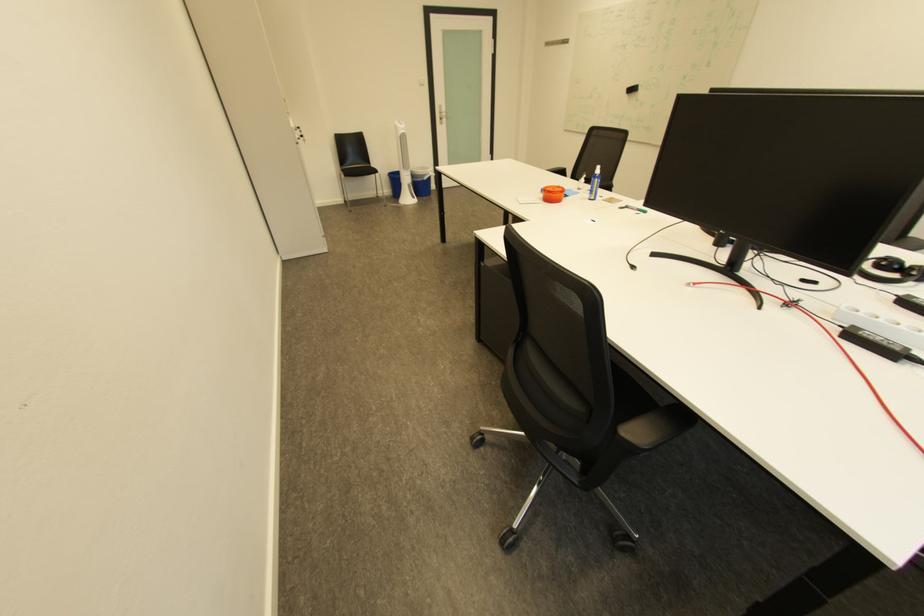
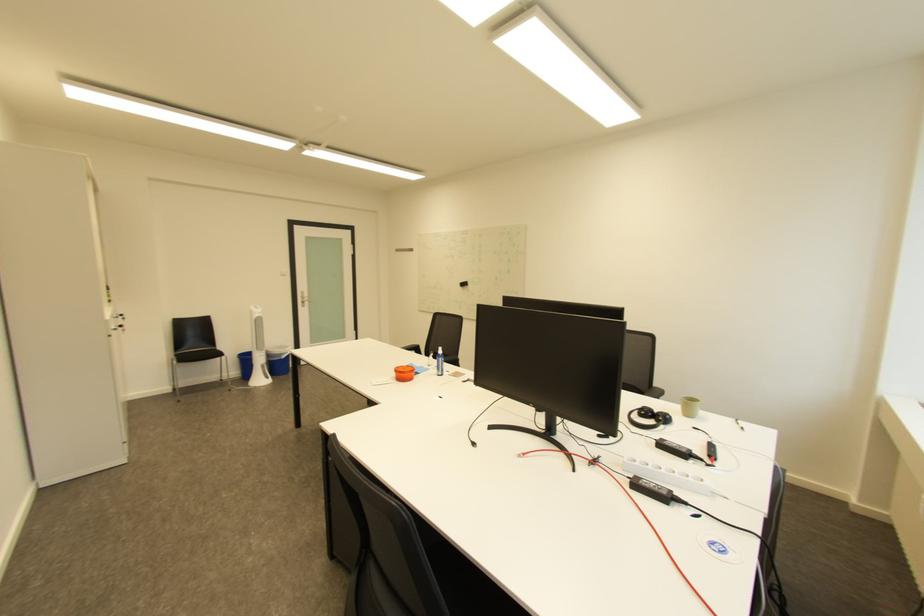
Where in the second image is the point corresponding to [301,130] from the first image?

(116, 322)